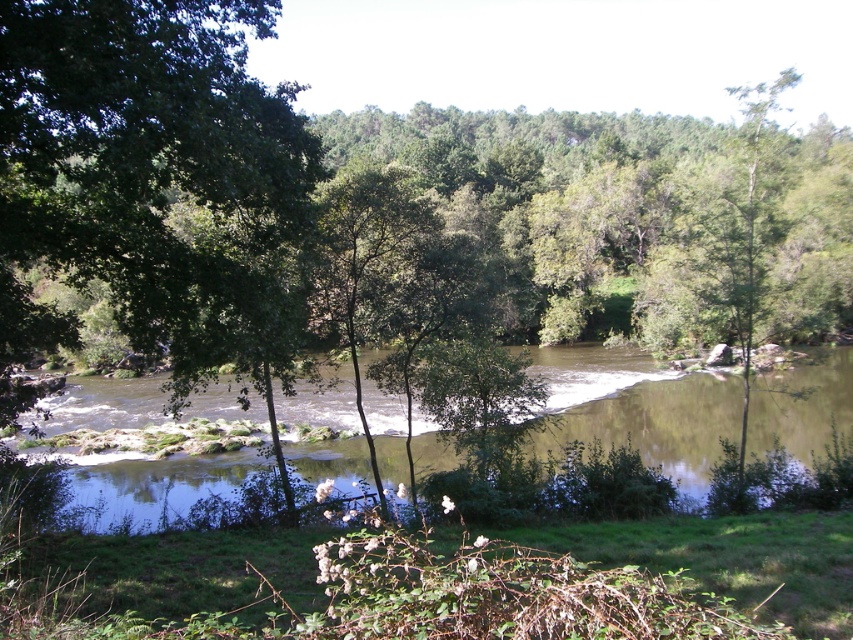
Which of these two, brown smooth river at center or green leafy tree at upper right, stands shorter?

With less height is brown smooth river at center.

What do you see at coordinates (637, 408) in the screenshot?
I see `brown smooth river at center` at bounding box center [637, 408].

Image resolution: width=853 pixels, height=640 pixels. What do you see at coordinates (637, 408) in the screenshot?
I see `brown smooth river at center` at bounding box center [637, 408].

At what (x,y) coordinates should I click in order to perform the action: click on brown smooth river at center. Please return your answer as a coordinate pair (x, y). Looking at the image, I should click on (637, 408).